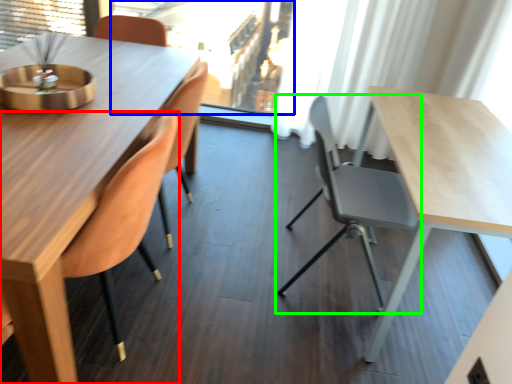
Question: Which object is positioned closest to chair (highlighted by a red box)? Select from window screen (highlighted by a blue box) and chair (highlighted by a green box).

Choices:
 (A) window screen
 (B) chair

Answer: (B)